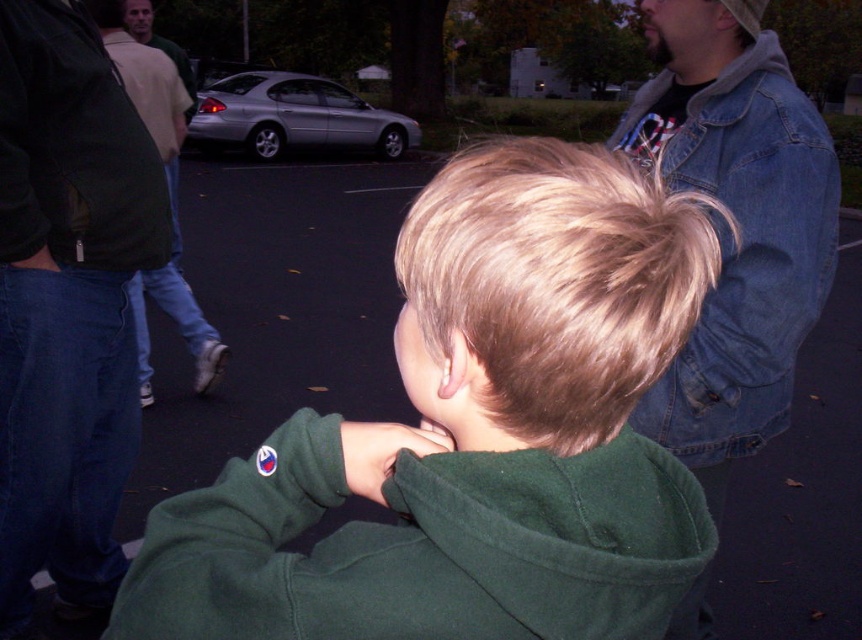
Question: Does dark green jacket at left have a lesser width compared to light brown denim jeans at left?

Choices:
 (A) yes
 (B) no

Answer: (A)

Question: Which object is positioned farthest from the dark green jacket at left?

Choices:
 (A) green fleece jacket at center
 (B) dark green fleece sweatshirt at left
 (C) light brown denim jeans at left

Answer: (C)

Question: Which point appears farthest from the camera in this image?

Choices:
 (A) click(x=778, y=132)
 (B) click(x=122, y=109)
 (C) click(x=210, y=332)
 (D) click(x=105, y=369)

Answer: (C)

Question: Which object is closer to the camera taking this photo?

Choices:
 (A) green fleece jacket at center
 (B) dark green fleece sweatshirt at left
 (C) light brown denim jeans at left
 (D) denim jacket at upper right

Answer: (A)

Question: Is green fleece jacket at center further to camera compared to dark green jacket at left?

Choices:
 (A) yes
 (B) no

Answer: (B)

Question: Does green fleece jacket at center come behind dark green jacket at left?

Choices:
 (A) yes
 (B) no

Answer: (B)